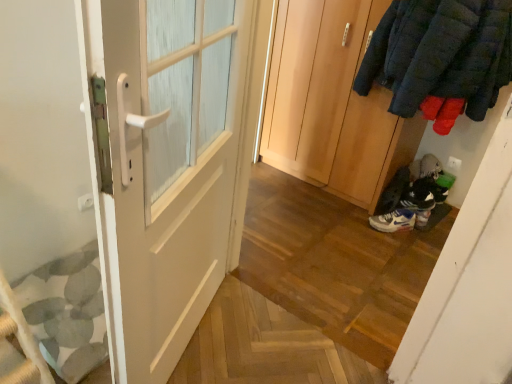
Question: Is point (23, 122) positioned closer to the camera than point (397, 213)?

Choices:
 (A) farther
 (B) closer

Answer: (B)

Question: Is white matte door at left, which is counted as the 2th door, starting from the right, situated inside white matte sneaker at lower right, positioned as the 2th footwear in right-to-left order, or outside?

Choices:
 (A) outside
 (B) inside

Answer: (A)

Question: Which object is the farthest from the white matte sneaker at lower right, the first footwear viewed from the left?

Choices:
 (A) white matte door at left, which is the first door in front-to-back order
 (B) white leather sneakers at lower right, which is the 1th footwear in right-to-left order
 (C) wooden wardrobe at center, the 1th door when ordered from right to left

Answer: (A)

Question: Based on their relative distances, which object is nearer to the white matte door at left, which ranks as the second door in back-to-front order?

Choices:
 (A) wooden wardrobe at center, the second door viewed from the front
 (B) white leather sneakers at lower right, which appears as the second footwear when viewed from the left
 (C) white matte sneaker at lower right, the first footwear viewed from the left

Answer: (A)